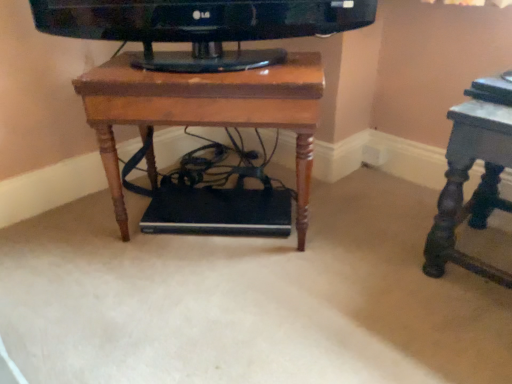
This screenshot has height=384, width=512. I want to click on free spot to the left of dark gray polished wood table at right, which is counted as the second table, starting from the left, so click(383, 261).